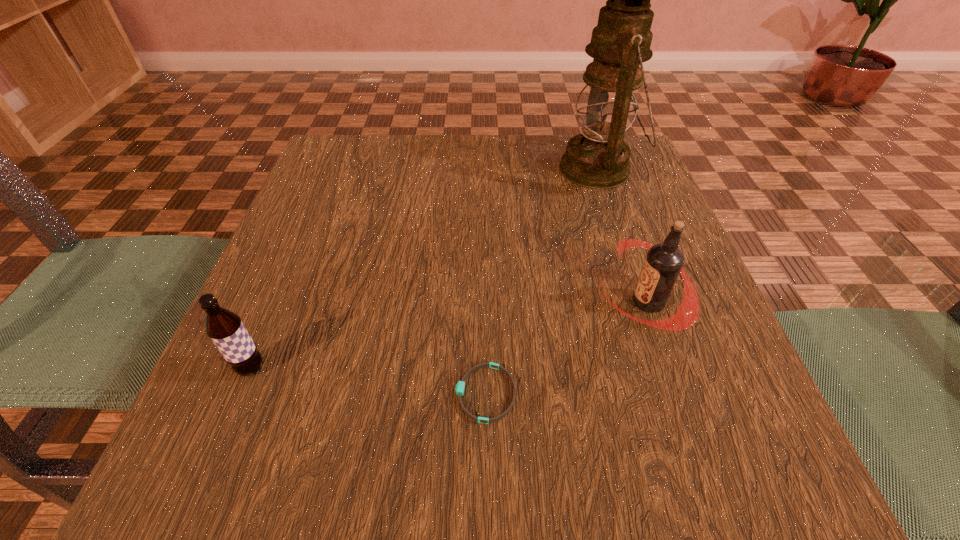
The height and width of the screenshot is (540, 960). I want to click on object at the far right corner, so click(598, 158).

Image resolution: width=960 pixels, height=540 pixels. I want to click on free space at the far edge of the desktop, so click(549, 147).

The image size is (960, 540). In the image, there is a desktop. Identify the location of free space at the near edge. (478, 484).

At what (x,y) coordinates should I click in order to perform the action: click on vacant space at the left edge of the desktop. Please return your answer as a coordinate pair (x, y). Image resolution: width=960 pixels, height=540 pixels. Looking at the image, I should click on (317, 225).

I want to click on vacant region at the right edge of the desktop, so point(691,339).

Image resolution: width=960 pixels, height=540 pixels. Identify the location of vacant space at the far left corner of the desktop. (372, 192).

Identify the location of vacant area at the near left corner. The image size is (960, 540). (180, 474).

Find the location of a particular element. This screenshot has width=960, height=540. vacant area that lies between the leftmost object and the right root beer is located at coordinates (449, 335).

At what (x,y) coordinates should I click in order to perform the action: click on free spot between the right root beer and the tallest object. Please return your answer as a coordinate pair (x, y). This screenshot has width=960, height=540. Looking at the image, I should click on (623, 235).

The width and height of the screenshot is (960, 540). Identify the location of unoccupied area between the farthest object and the third nearest object. (623, 235).